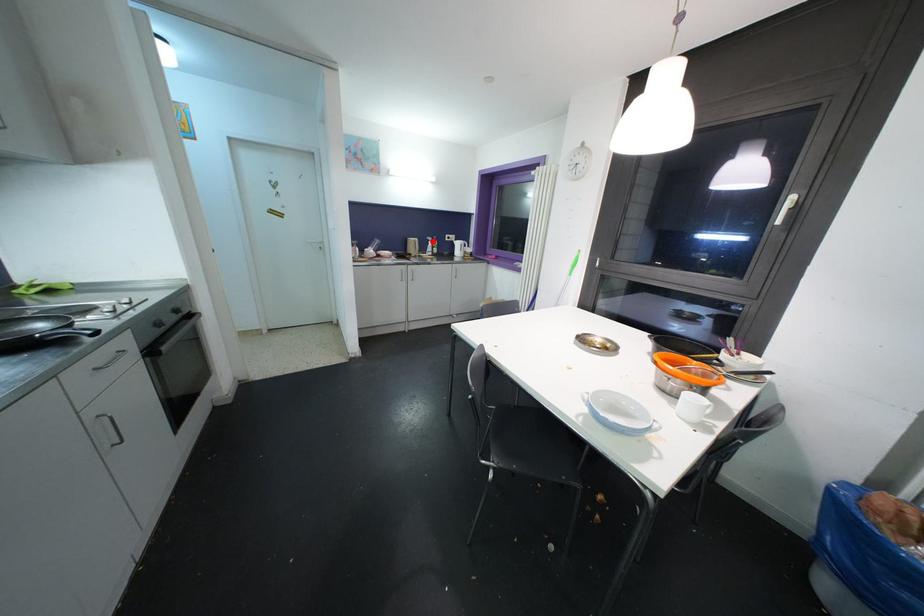
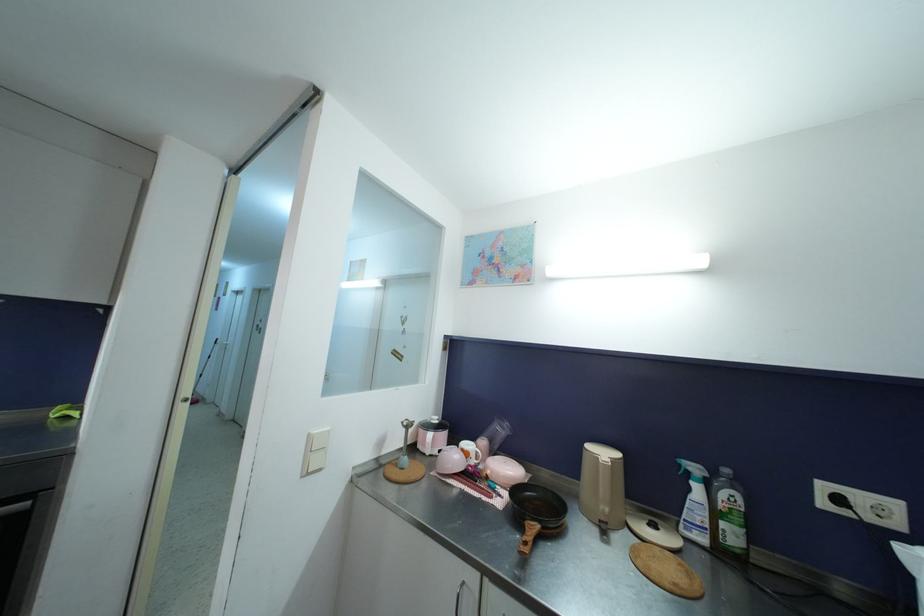
Find the pixel in the second image that matches the highlighted location in the first image.

(699, 472)